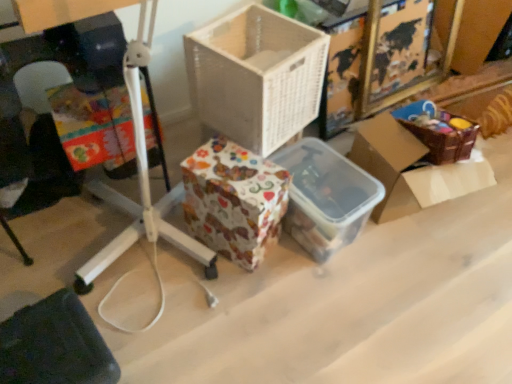
This screenshot has width=512, height=384. What are the coordinates of `vacant region above dark fabric at lower left (from a real-world perspective)` in the screenshot? It's located at (47, 345).